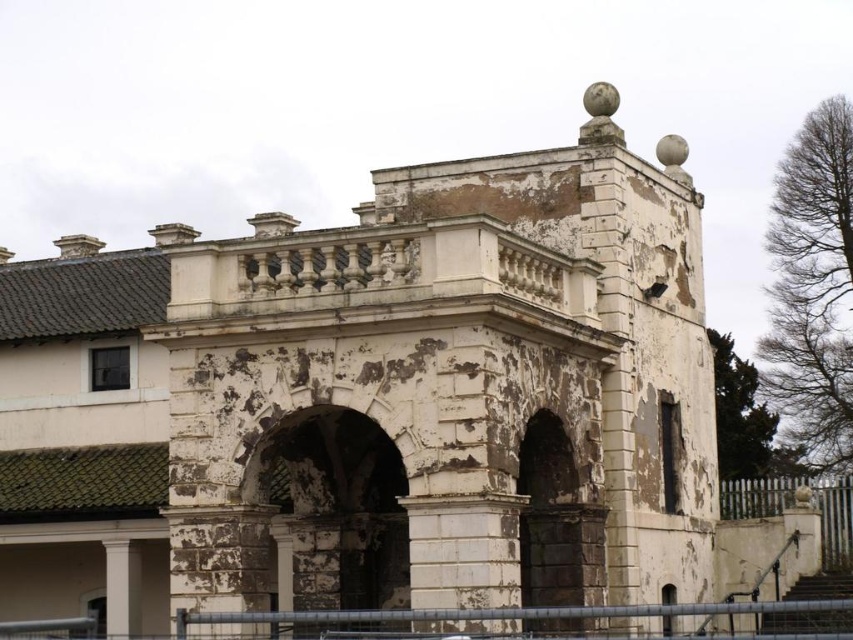
You are standing at the entrance of the old building and notice two fences. The metallic gray fence at lower center and the white wooden fence at lower right. Which fence is positioned higher from the ground?

The metallic gray fence at lower center is above the white wooden fence at lower right, so it is positioned higher from the ground.

You are standing at the entrance of the old building and want to take a photo of the metallic gray fence at lower center. If your camera can focus on objects up to 100 feet away, will it be able to capture the fence clearly?

The metallic gray fence at lower center is 98.68 feet away from the camera, which is within the 100 feet focus range. Therefore, the camera should be able to capture the fence clearly.

You are a painter hired to restore the old building. You need to assess the fences. Which fence, the metallic gray fence at lower center or the white wooden fence at lower right, requires more material for painting due to its size?

The metallic gray fence at lower center requires more material for painting because it is larger in size than the white wooden fence at lower right.